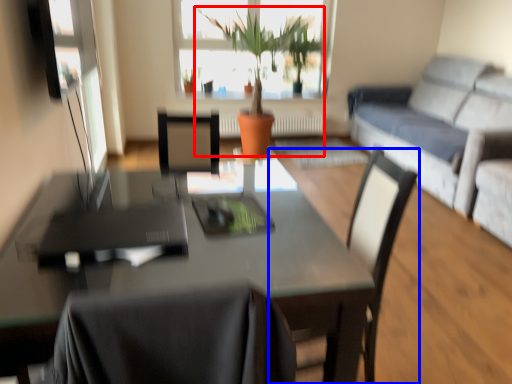
Question: Which point is closer to the camera, houseplant (highlighted by a red box) or chair (highlighted by a blue box)?

Choices:
 (A) houseplant
 (B) chair

Answer: (B)